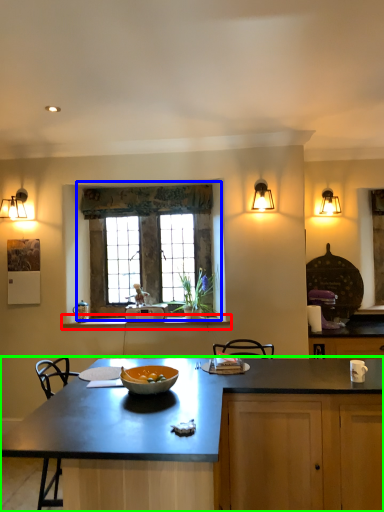
Question: Which is nearer to the window sill (highlighted by a red box)? window (highlighted by a blue box) or countertop (highlighted by a green box).

Choices:
 (A) window
 (B) countertop

Answer: (A)